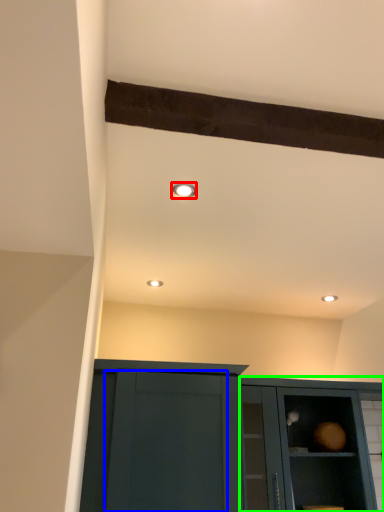
Question: Which object is the closest to the lighting (highlighted by a red box)? Choose among these: glass door (highlighted by a blue box) or cabinetry (highlighted by a green box).

Choices:
 (A) glass door
 (B) cabinetry

Answer: (A)